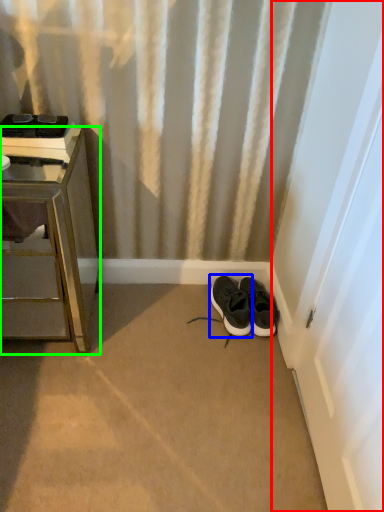
Question: Considering the real-world distances, which object is closest to screen door (highlighted by a red box)? footwear (highlighted by a blue box) or furniture (highlighted by a green box).

Choices:
 (A) footwear
 (B) furniture

Answer: (A)